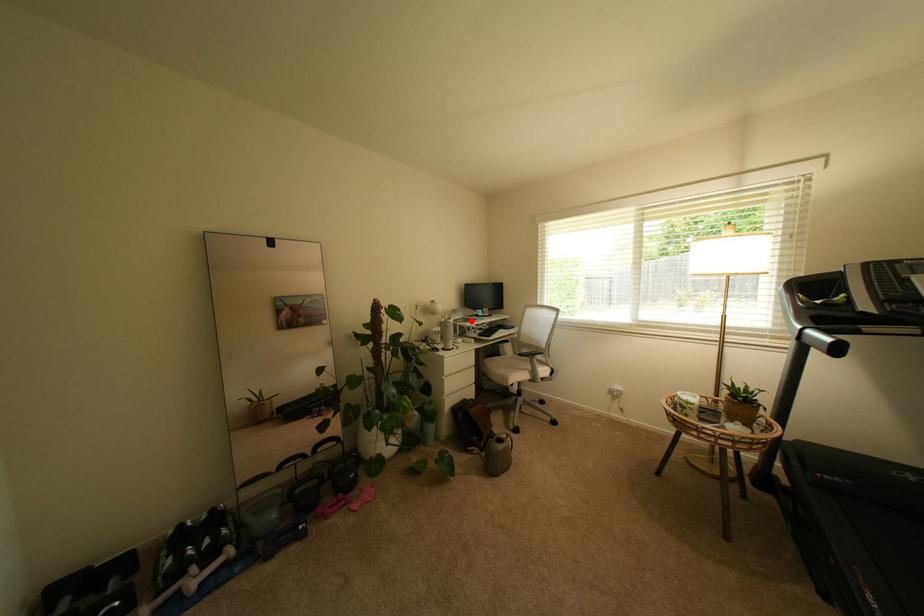
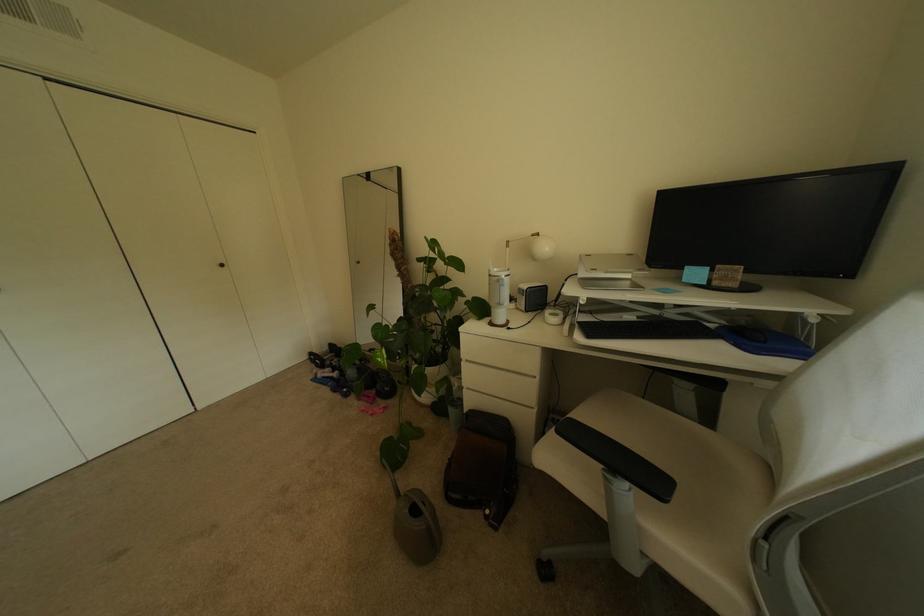
The point at the highlighted location is marked in the first image. Where is the corresponding point in the second image?

(637, 284)